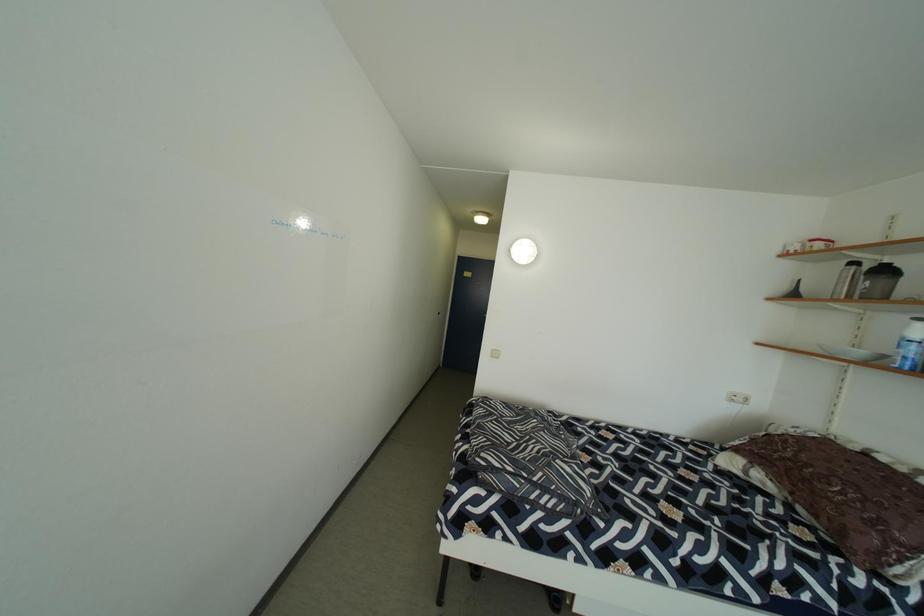
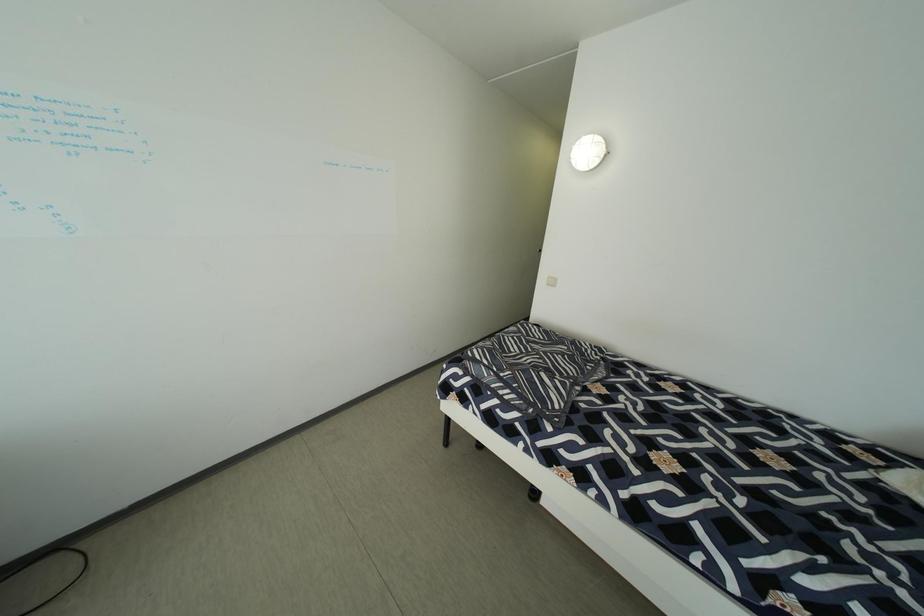
Question: The camera is either moving clockwise (left) or counter-clockwise (right) around the object. The first image is from the beginning of the video and the second image is from the end. Is the camera moving left or right when shooting the video?

Choices:
 (A) Left
 (B) Right

Answer: (B)